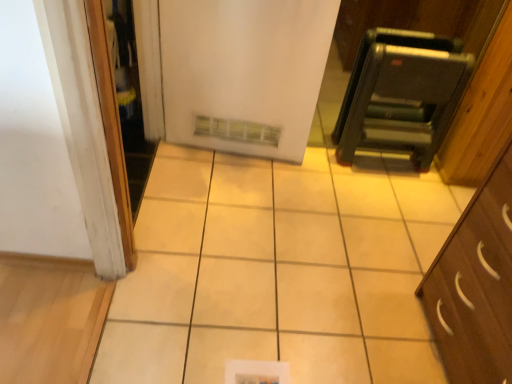
Where is `unoccupied area in front of metallic black step ladder at upper right`? The image size is (512, 384). unoccupied area in front of metallic black step ladder at upper right is located at coordinates (377, 201).